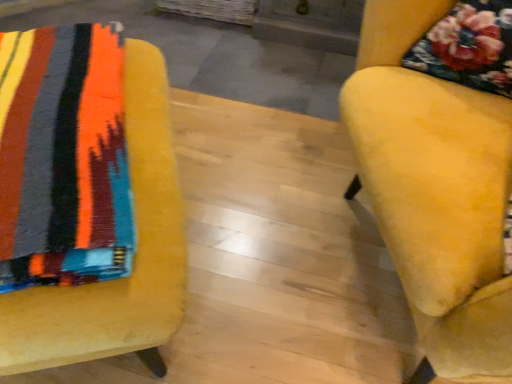
Question: In terms of width, does velvet yellow chair at right, the second chair when ordered from left to right, look wider or thinner when compared to velvet yellow chair at left, which ranks as the first chair in left-to-right order?

Choices:
 (A) wide
 (B) thin

Answer: (B)

Question: In the image, is velvet yellow chair at right, the second chair when ordered from left to right, on the left side or the right side of velvet yellow chair at left, which ranks as the first chair in left-to-right order?

Choices:
 (A) right
 (B) left

Answer: (A)

Question: Is point (420, 291) closer or farther from the camera than point (22, 150)?

Choices:
 (A) farther
 (B) closer

Answer: (A)

Question: In terms of height, does velvet yellow chair at left, which ranks as the first chair in left-to-right order, look taller or shorter compared to velvet yellow chair at right, the second chair when ordered from left to right?

Choices:
 (A) tall
 (B) short

Answer: (B)

Question: From a real-world perspective, relative to velvet yellow chair at right, which is the 1th chair in right-to-left order, is velvet yellow chair at left, which is the second chair in right-to-left order, vertically above or below?

Choices:
 (A) below
 (B) above

Answer: (A)

Question: Is velvet yellow chair at left, which ranks as the first chair in left-to-right order, situated inside velvet yellow chair at right, the second chair when ordered from left to right, or outside?

Choices:
 (A) outside
 (B) inside

Answer: (A)

Question: In terms of width, does velvet yellow chair at left, which is the second chair in right-to-left order, look wider or thinner when compared to velvet yellow chair at right, the second chair when ordered from left to right?

Choices:
 (A) thin
 (B) wide

Answer: (B)